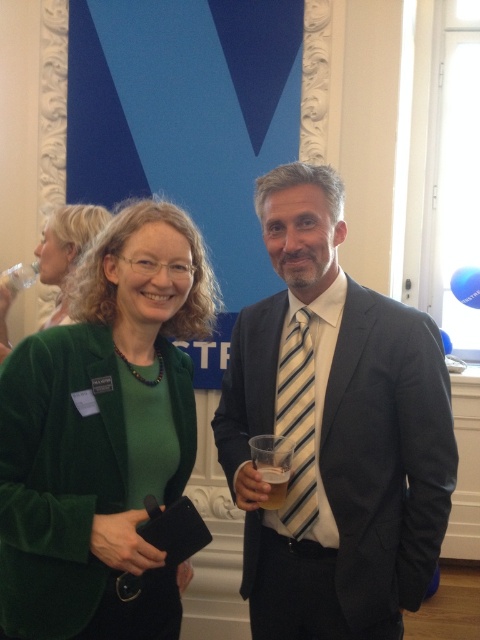
Is striped silk tie at center to the left of striped fabric tie at center from the viewer's perspective?

Incorrect, striped silk tie at center is not on the left side of striped fabric tie at center.

Which is above, striped silk tie at center or striped fabric tie at center?

striped silk tie at center

This screenshot has height=640, width=480. Describe the element at coordinates (335, 432) in the screenshot. I see `striped silk tie at center` at that location.

Locate an element on the screen. Image resolution: width=480 pixels, height=640 pixels. striped silk tie at center is located at coordinates (335, 432).

Who is taller, striped silk tie at center or green velvet jacket at lower left?

Standing taller between the two is striped silk tie at center.

Is point (343, 484) less distant than point (52, 324)?

Yes, point (343, 484) is in front of point (52, 324).

Is point (408, 525) positioned behind point (58, 301)?

No, (408, 525) is in front of (58, 301).

Locate an element on the screen. This screenshot has height=640, width=480. striped silk tie at center is located at coordinates (335, 432).

Is velvet green blazer at center closer to the viewer compared to translucent plastic cup at center?

Yes, velvet green blazer at center is closer to the viewer.

Locate an element on the screen. velvet green blazer at center is located at coordinates (103, 435).

I want to click on velvet green blazer at center, so click(x=103, y=435).